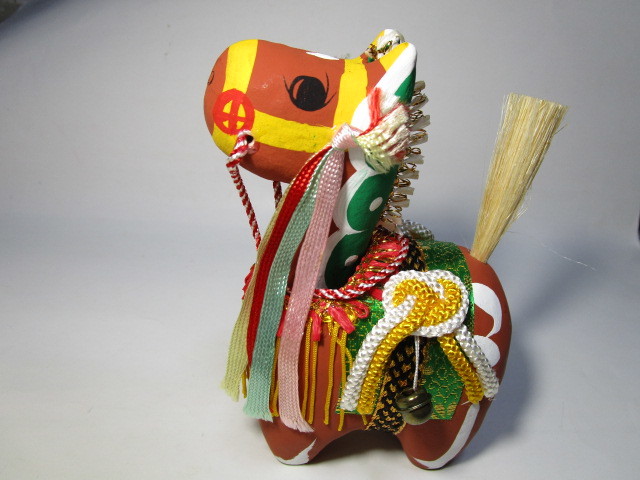
Find the location of `toy horse`. toy horse is located at coordinates (272, 88).